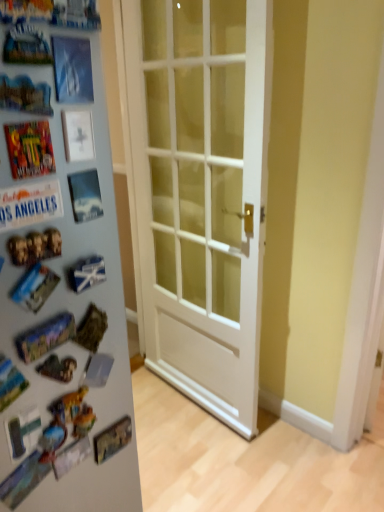
Question: Is white glossy door at center completely or partially outside of white glossy refrigerator at left?

Choices:
 (A) yes
 (B) no

Answer: (A)

Question: Could white glossy refrigerator at left be considered to be inside white glossy door at center?

Choices:
 (A) no
 (B) yes

Answer: (A)

Question: Does white glossy door at center have a lesser height compared to white glossy refrigerator at left?

Choices:
 (A) no
 (B) yes

Answer: (B)

Question: From the image's perspective, is white glossy door at center located above white glossy refrigerator at left?

Choices:
 (A) no
 (B) yes

Answer: (A)

Question: From the image's perspective, is white glossy door at center located beneath white glossy refrigerator at left?

Choices:
 (A) yes
 (B) no

Answer: (A)

Question: Is the depth of white glossy door at center greater than that of white glossy refrigerator at left?

Choices:
 (A) no
 (B) yes

Answer: (B)

Question: Considering the relative sizes of white glossy refrigerator at left and white glossy door at center in the image provided, is white glossy refrigerator at left shorter than white glossy door at center?

Choices:
 (A) no
 (B) yes

Answer: (A)

Question: Considering the relative positions of white glossy refrigerator at left and white glossy door at center in the image provided, is white glossy refrigerator at left to the left of white glossy door at center from the viewer's perspective?

Choices:
 (A) no
 (B) yes

Answer: (B)

Question: Is white glossy refrigerator at left looking in the opposite direction of white glossy door at center?

Choices:
 (A) yes
 (B) no

Answer: (A)

Question: Considering the relative sizes of white glossy refrigerator at left and white glossy door at center in the image provided, is white glossy refrigerator at left bigger than white glossy door at center?

Choices:
 (A) no
 (B) yes

Answer: (B)

Question: Is white glossy refrigerator at left directly adjacent to white glossy door at center?

Choices:
 (A) no
 (B) yes

Answer: (A)

Question: From a real-world perspective, is white glossy refrigerator at left positioned under white glossy door at center based on gravity?

Choices:
 (A) yes
 (B) no

Answer: (B)

Question: From a real-world perspective, is white glossy door at center under shiny metallic comic book at left?

Choices:
 (A) yes
 (B) no

Answer: (A)